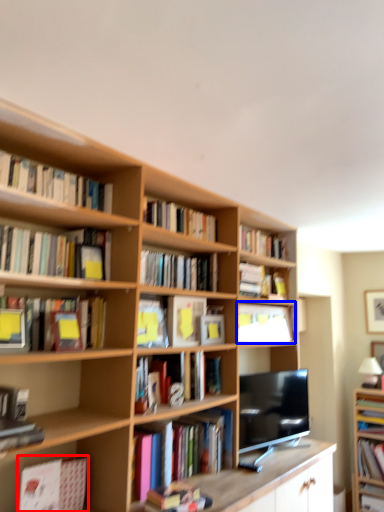
Question: Which object is further to the camera taking this photo, book (highlighted by a red box) or book (highlighted by a blue box)?

Choices:
 (A) book
 (B) book

Answer: (B)